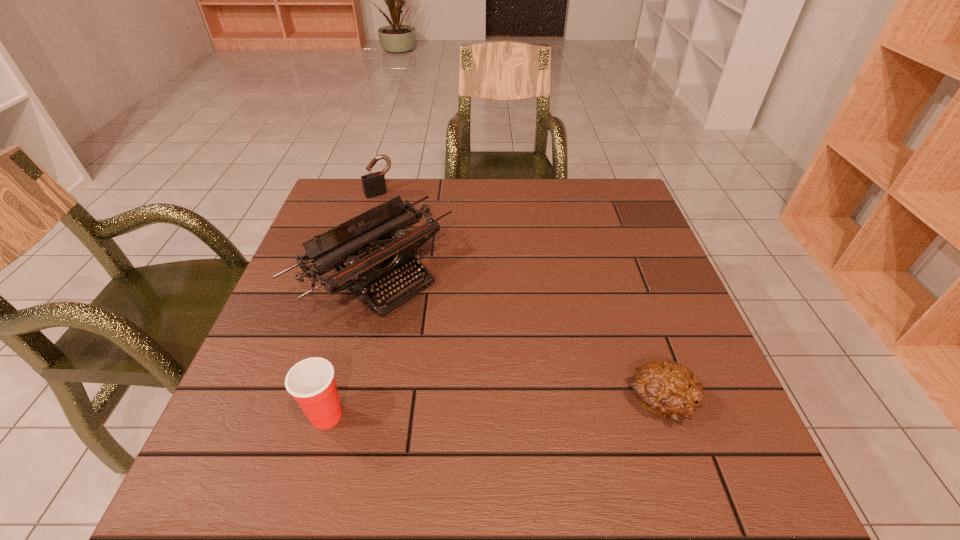
Identify the location of free space at the far right corner of the desktop. (596, 187).

The width and height of the screenshot is (960, 540). Identify the location of free spot between the Dixie cup and the padlock. (353, 305).

Locate an element on the screen. Image resolution: width=960 pixels, height=540 pixels. vacant area that lies between the padlock and the rightmost object is located at coordinates (519, 298).

Find the location of a particular element. vacant space that is in between the muffin and the typewriter is located at coordinates (518, 339).

Locate an element on the screen. The height and width of the screenshot is (540, 960). free space between the farthest object and the shortest object is located at coordinates (519, 298).

Locate an element on the screen. Image resolution: width=960 pixels, height=540 pixels. empty space that is in between the Dixie cup and the padlock is located at coordinates (353, 305).

Where is `vacant area that lies between the typewriter and the Dixie cup`? vacant area that lies between the typewriter and the Dixie cup is located at coordinates pos(351,345).

The width and height of the screenshot is (960, 540). I want to click on vacant point located between the padlock and the muffin, so click(519, 298).

Identify the location of vacant space that is in between the second farthest object and the Dixie cup. (351, 345).

In order to click on the third closest object to the Dixie cup in this screenshot , I will do `click(374, 184)`.